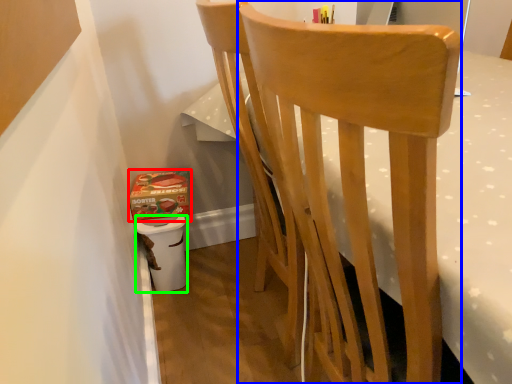
Question: Based on their relative distances, which object is farther from box (highlighted by a red box)? Choose from chair (highlighted by a blue box) and potty (highlighted by a green box).

Choices:
 (A) chair
 (B) potty

Answer: (A)